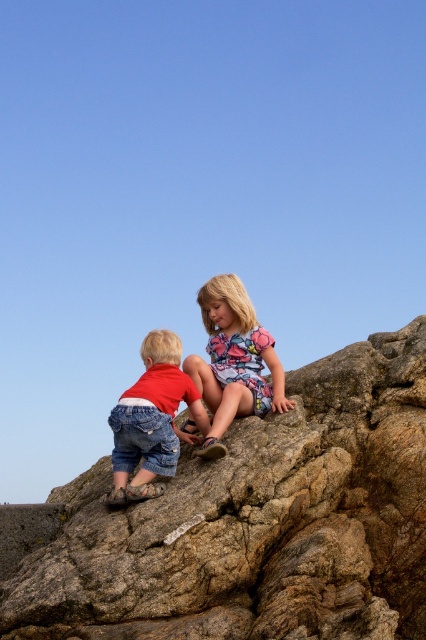
You are a photographer trying to capture the two children in the scene. You want to ensure that both the brown rough rock at center and the floral fabric dress at center are clearly visible in your shot. Given their sizes, which object should you focus on to ensure both are in frame without needing to zoom in or out?

The brown rough rock at center is wider than the floral fabric dress at center. To ensure both are in frame without adjusting the zoom, focus on the brown rough rock at center since it is larger and will help frame the shot appropriately.

You are a photographer setting up a shoot on a rocky terrain. You have two subjects wearing the floral fabric dress at center and denim shorts at lower left. To ensure both fit comfortably in the frame, you need to know which clothing item takes up more horizontal space. Which one is wider?

The floral fabric dress at center is wider than the denim shorts at lower left.